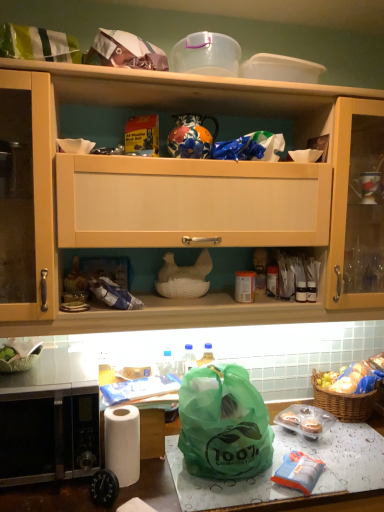
Locate an element on the screen. The image size is (384, 512). vacant region above stainless steel microwave at lower left (from a real-world perspective) is located at coordinates (38, 377).